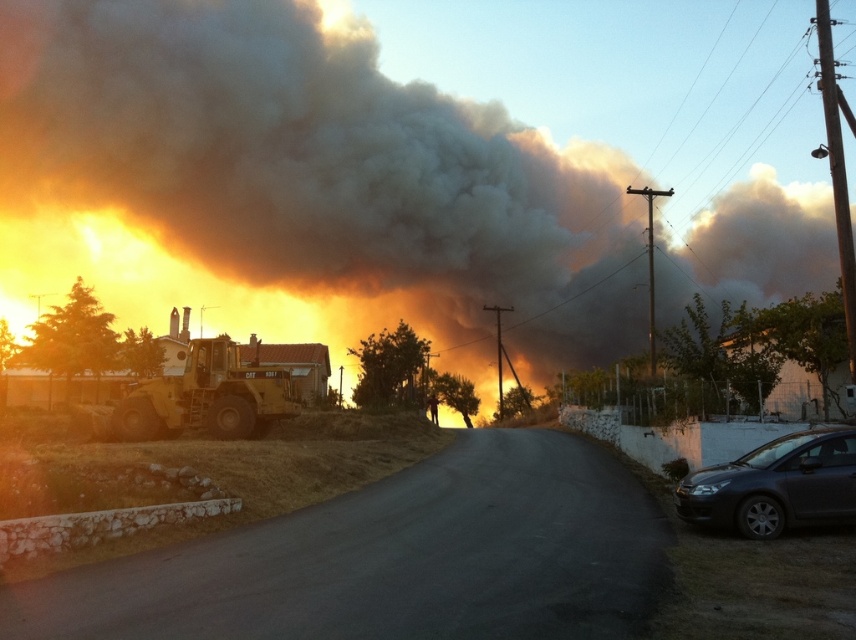
Question: Is black smoke at upper center smaller than dark gray metallic car at lower right?

Choices:
 (A) no
 (B) yes

Answer: (A)

Question: Is black smoke at upper center closer to the viewer compared to dark gray metallic car at lower right?

Choices:
 (A) no
 (B) yes

Answer: (A)

Question: Is black smoke at upper center to the left of dark gray metallic car at lower right from the viewer's perspective?

Choices:
 (A) no
 (B) yes

Answer: (B)

Question: Which point appears farthest from the camera in this image?

Choices:
 (A) (846, 444)
 (B) (718, 232)

Answer: (B)